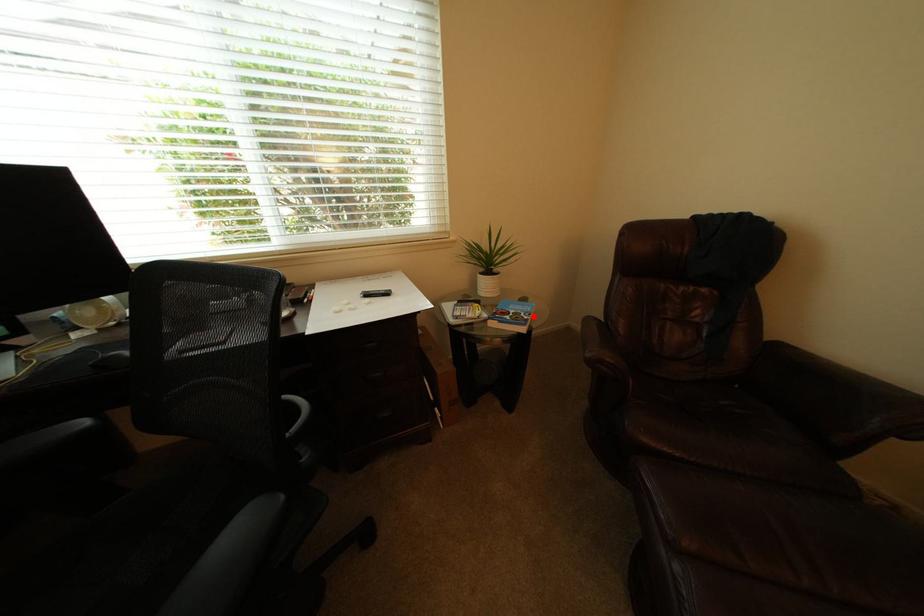
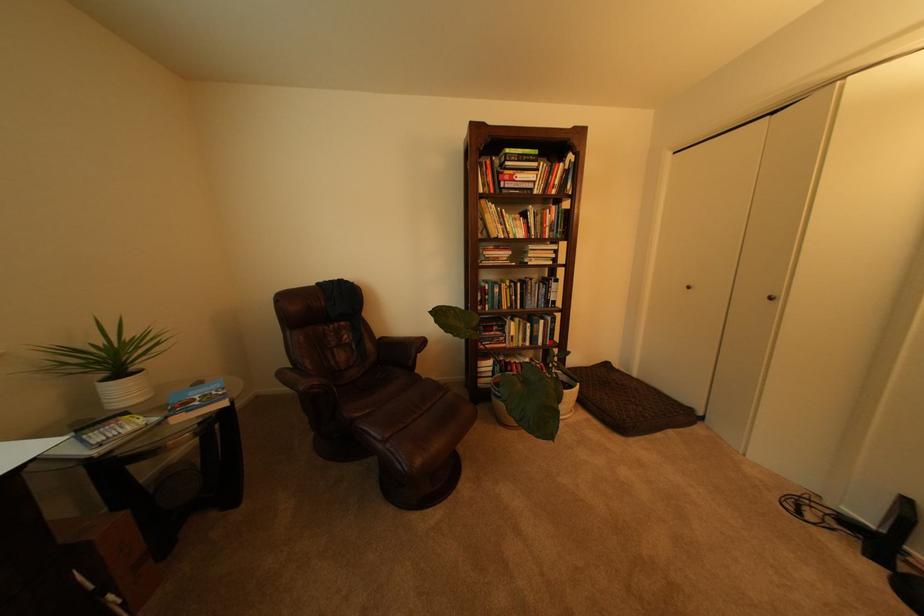
The point at the highlighted location is marked in the first image. Where is the corresponding point in the second image?

(225, 395)